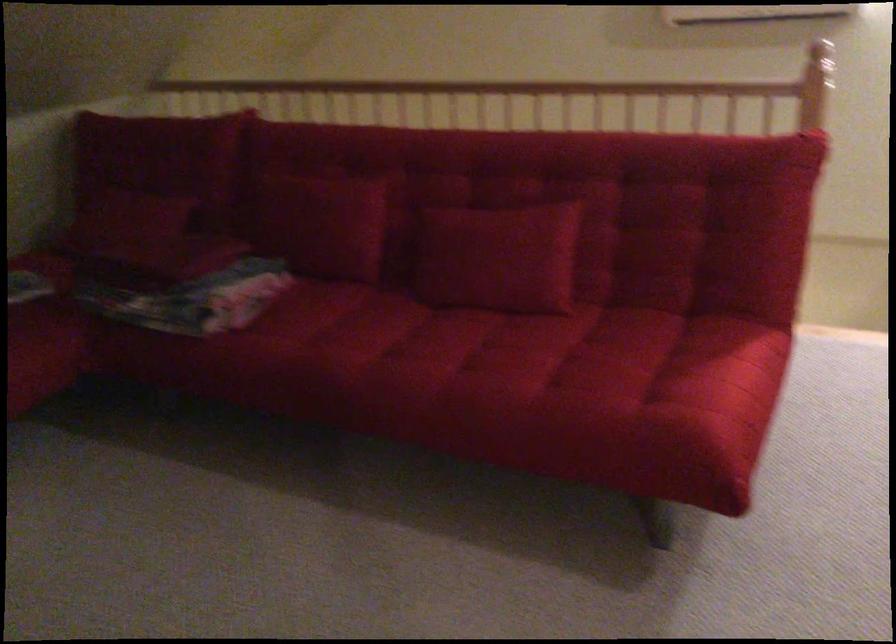
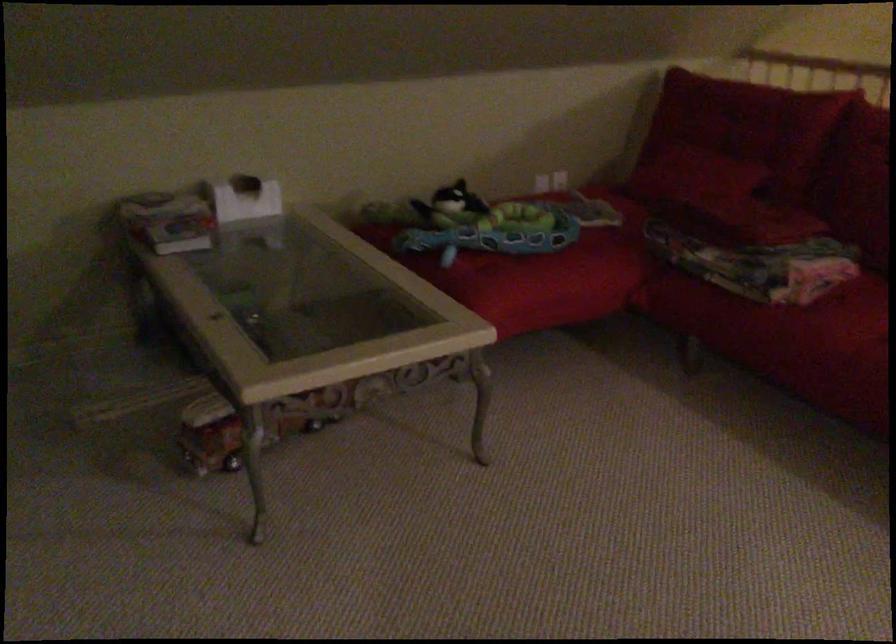
Question: I am providing you with two images of the same scene from different viewpoints. Which of the following objects are not visible in image2?

Choices:
 (A) blue toy tray
 (B) white tissue box
 (C) red sofa pillow
 (D) none of these

Answer: (D)